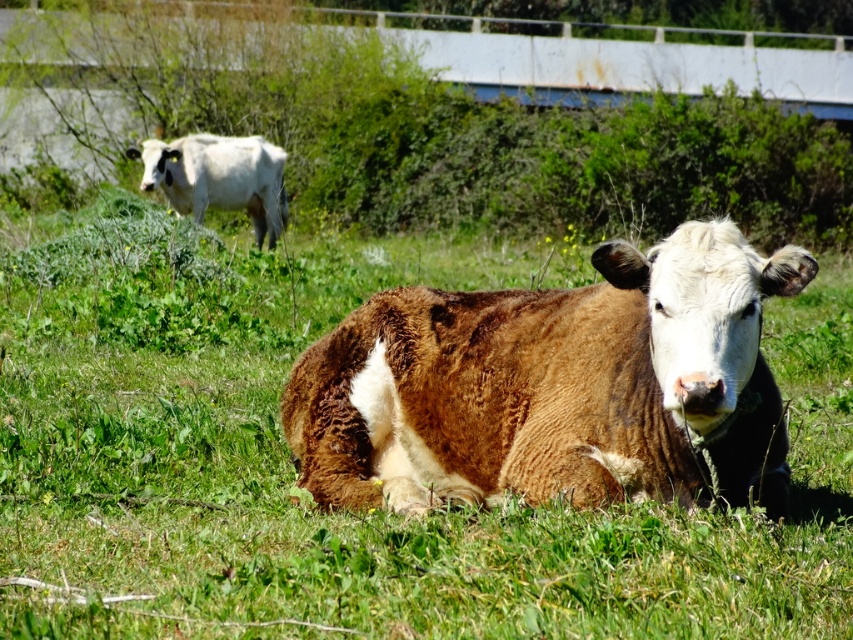
You are a farmer checking the field. You see the green grassy at center and the white smooth cow at upper left. Which one is taller?

The green grassy at center is much taller than the white smooth cow at upper left.

You are a farmer checking the field. You notice the brown furry cow at center and the white smooth cow at upper left. Which cow is bigger in size?

The brown furry cow at center is smaller than the white smooth cow at upper left, so the white smooth cow at upper left is bigger in size.

You are a photographer trying to capture a wide shot of the green grassy at center and the brown furry cow at center. Based on their positions, which one would occupy more of the horizontal space in the photo?

The green grassy at center might be wider than brown furry cow at center, so it would occupy more horizontal space in the photo.